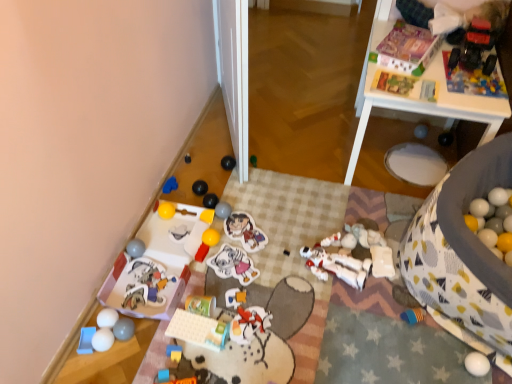
What are the coordinates of `spots to the right of smooth plastic balls at lower left, marked as the 4th toy in a left-to-right arrangement` in the screenshot? It's located at (165, 329).